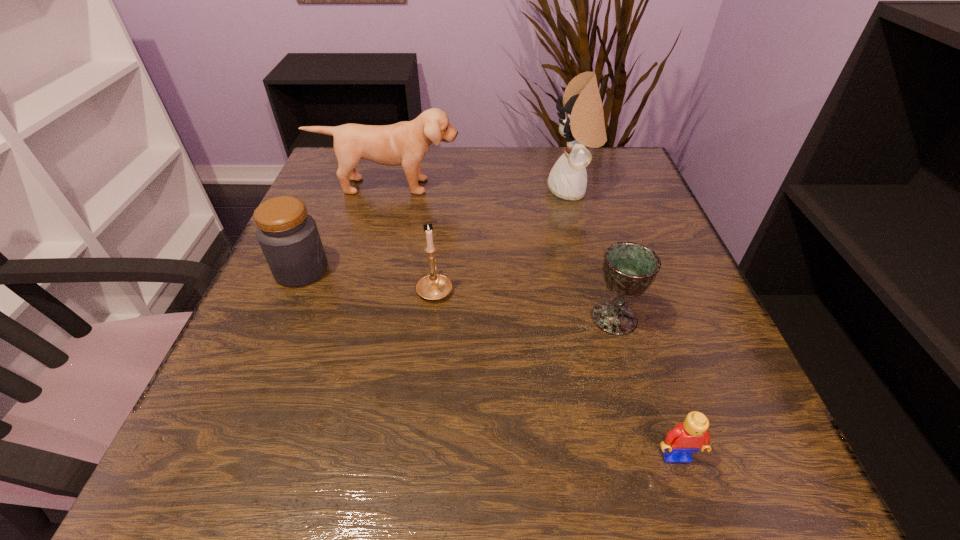
I want to click on the tallest object, so click(583, 124).

You are a GUI agent. You are given a task and a screenshot of the screen. Output one action in this format:
    pyautogui.click(x=<x>, y=<y>)
    Task: Click on the puppy
    
    Given the screenshot: What is the action you would take?
    pyautogui.click(x=405, y=143)

Locate an element on the screen. candle holder is located at coordinates (434, 286).

The width and height of the screenshot is (960, 540). I want to click on jar, so click(288, 236).

At what (x,y) coordinates should I click in order to perform the action: click on chalice. Please return your answer as a coordinate pair (x, y). The width and height of the screenshot is (960, 540). Looking at the image, I should click on (629, 268).

Where is `the nearest object`? the nearest object is located at coordinates (687, 437).

The height and width of the screenshot is (540, 960). Identify the location of Lego. (687, 437).

Where is `vacant space situated at the front face of the tallest object`? The height and width of the screenshot is (540, 960). vacant space situated at the front face of the tallest object is located at coordinates (484, 191).

You are a GUI agent. You are given a task and a screenshot of the screen. Output one action in this format:
    pyautogui.click(x=<x>, y=<y>)
    Task: Click on the vacant space situated at the front face of the tallest object
    Image resolution: width=960 pixels, height=540 pixels.
    Given the screenshot: What is the action you would take?
    pyautogui.click(x=411, y=191)

This screenshot has height=540, width=960. I want to click on free space located 0.250m at the front face of the tallest object, so click(x=441, y=191).